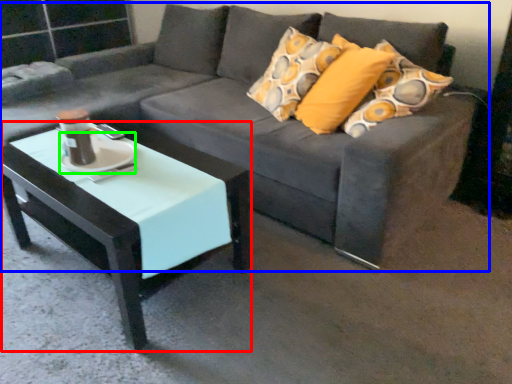
Question: Based on their relative distances, which object is nearer to coffee table (highlighted by a red box)? Choose from studio couch (highlighted by a blue box) and saucer (highlighted by a green box).

Choices:
 (A) studio couch
 (B) saucer

Answer: (B)